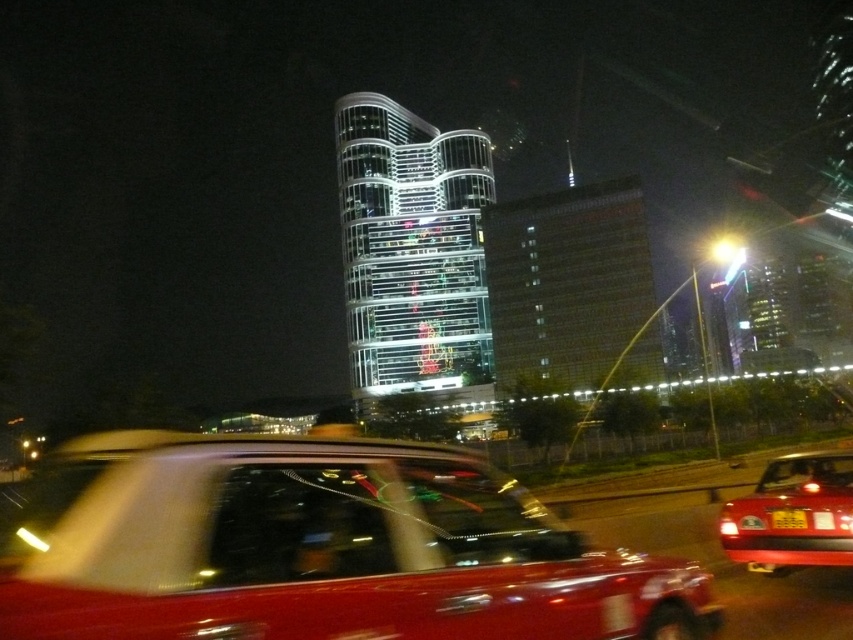
Image resolution: width=853 pixels, height=640 pixels. Find the location of `glassy reflective building at center`. glassy reflective building at center is located at coordinates (572, 289).

Between glassy reflective building at center and shiny red car at lower right, which one appears on the right side from the viewer's perspective?

From the viewer's perspective, shiny red car at lower right appears more on the right side.

Does point (583, 257) come farther from viewer compared to point (743, 509)?

Yes, it is behind point (743, 509).

This screenshot has height=640, width=853. What are the coordinates of `glassy reflective building at center` in the screenshot? It's located at (572, 289).

Does shiny glass tower at center appear over shiny red car at lower right?

Yes.

Which is behind, point (415, 156) or point (749, 512)?

Point (415, 156)

The image size is (853, 640). Find the location of `shiny glass tower at center`. shiny glass tower at center is located at coordinates (412, 252).

Can you confirm if shiny glass tower at center is positioned to the right of yellow matte license plate at center?

No, shiny glass tower at center is not to the right of yellow matte license plate at center.

This screenshot has height=640, width=853. In order to click on shiny glass tower at center in this screenshot , I will do `click(412, 252)`.

Does point (451, 198) come farther from viewer compared to point (792, 515)?

Yes, it is.

Image resolution: width=853 pixels, height=640 pixels. What are the coordinates of `shiny glass tower at center` in the screenshot? It's located at (412, 252).